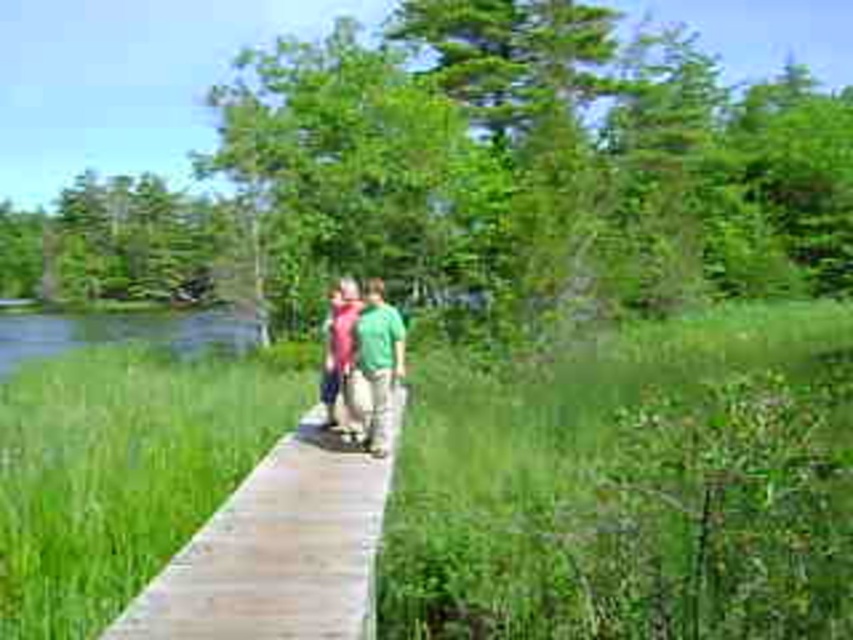
Question: Does wooden plank at center appear over matte pink sweater at center?

Choices:
 (A) no
 (B) yes

Answer: (A)

Question: Is wooden plank at center wider than matte pink sweater at center?

Choices:
 (A) no
 (B) yes

Answer: (A)

Question: Which object appears closest to the camera in this image?

Choices:
 (A) matte pink sweater at center
 (B) wooden plank at center

Answer: (B)

Question: Can you confirm if wooden plank at center is smaller than matte pink sweater at center?

Choices:
 (A) yes
 (B) no

Answer: (A)